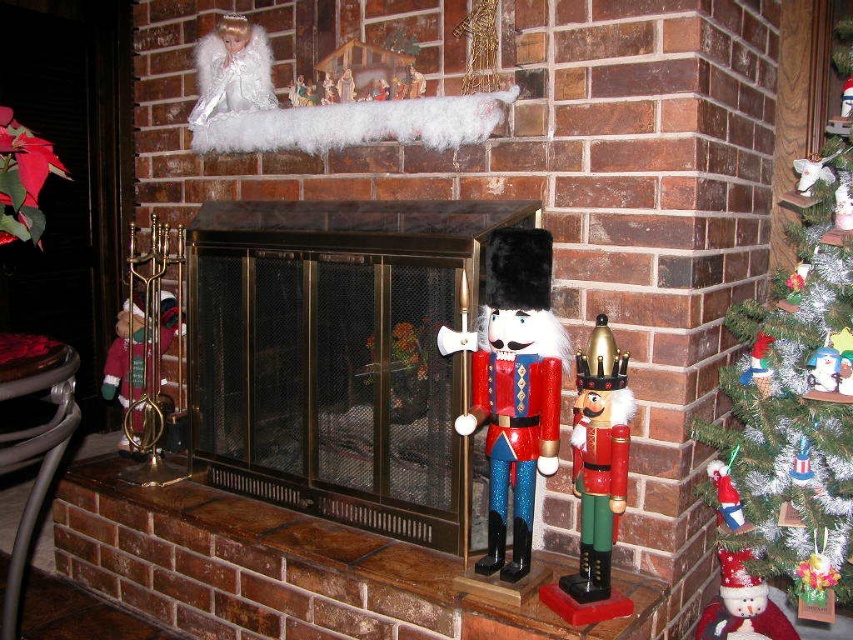
You are a delivery person who needs to place a new ornament on the frosted glass christmas tree at right. You are currently standing 1 meter away from the tree. Can you reach the ornament without moving closer?

The distance between the frosted glass christmas tree at right and the camera is 1.16 meters. Since you are standing 1 meter away, you are closer than the camera, so you can reach the ornament without moving closer.

You are decorating a living room and need to place a new ornament between the frosted glass christmas tree at right and the wooden nutcracker at right. Based on their positions, where should you place the ornament?

The frosted glass christmas tree at right is located above the wooden nutcracker at right, so you should place the ornament between them by positioning it below the frosted glass christmas tree at right and above the wooden nutcracker at right.

What object is located at the coordinates point [341,356] in the image?

The point [341,356] corresponds to the metallic gold fireplace at center.